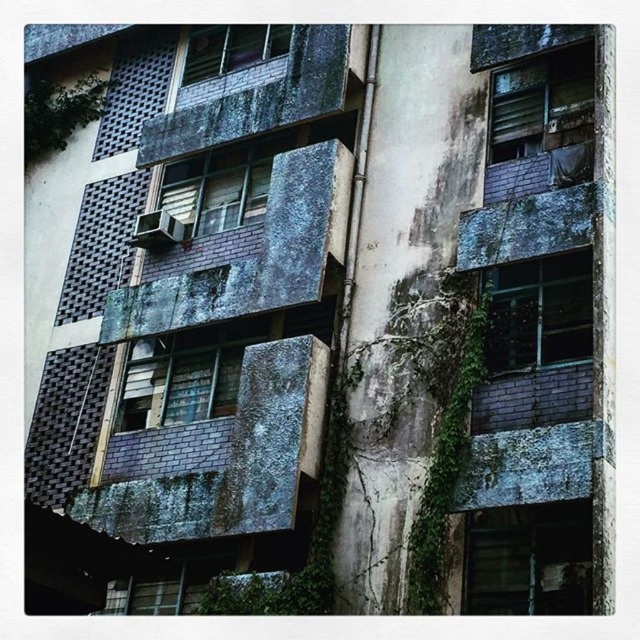
Question: Which point appears closest to the camera in this image?

Choices:
 (A) (538, 336)
 (B) (221, 161)
 (C) (461, 424)

Answer: (C)

Question: Does green mossy vine at center appear over matte glass window at upper center?

Choices:
 (A) yes
 (B) no

Answer: (B)

Question: Is green mossy vine at center thinner than matte gray concrete balcony at upper center?

Choices:
 (A) yes
 (B) no

Answer: (B)

Question: Does matte glass window at center lie in front of matte gray concrete balcony at upper center?

Choices:
 (A) no
 (B) yes

Answer: (B)

Question: Estimate the real-world distances between objects in this image. Which object is closer to the matte glass window at upper center?

Choices:
 (A) matte glass window at center
 (B) dark glass window at center right
 (C) matte gray concrete balcony at upper center
 (D) translucent glass window at center

Answer: (A)

Question: Estimate the real-world distances between objects in this image. Which object is farther from the rusty metal balcony at upper center?

Choices:
 (A) matte gray concrete balcony at upper center
 (B) dark glass window at center right
 (C) translucent glass window at center

Answer: (B)